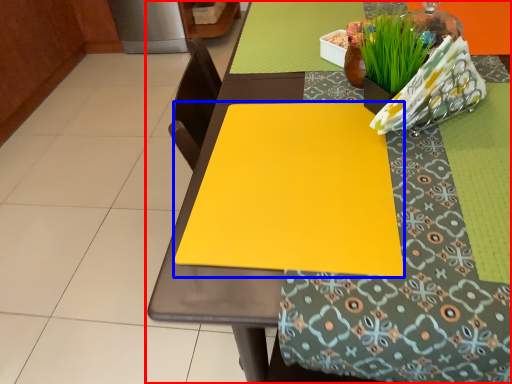
Question: Which object appears closest to the camera in this image, table (highlighted by a red box) or sheet (highlighted by a blue box)?

Choices:
 (A) table
 (B) sheet

Answer: (A)